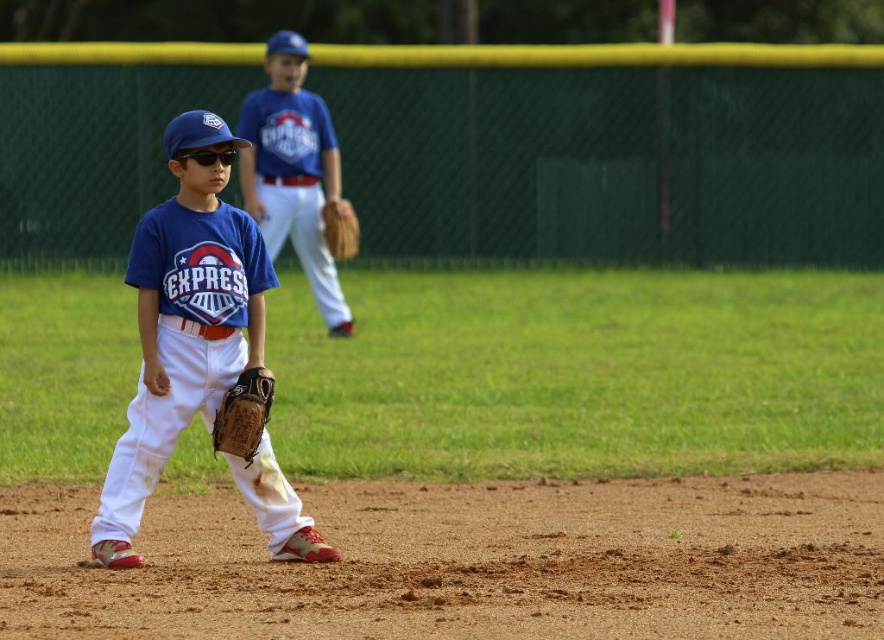
Is point (216, 380) farther from camera compared to point (326, 244)?

No, it is not.

Identify the location of matte blue jersey at center. (200, 352).

This screenshot has width=884, height=640. What do you see at coordinates (200, 352) in the screenshot?
I see `matte blue jersey at center` at bounding box center [200, 352].

This screenshot has height=640, width=884. What are the coordinates of `matte blue jersey at center` in the screenshot? It's located at (200, 352).

Locate an element on the screen. The width and height of the screenshot is (884, 640). matte blue jersey at center is located at coordinates (200, 352).

Does blue jersey at center have a greater height compared to brown leather glove at lower left?

Indeed, blue jersey at center has a greater height compared to brown leather glove at lower left.

Does blue jersey at center have a lesser width compared to brown leather glove at lower left?

Incorrect, blue jersey at center's width is not less than brown leather glove at lower left's.

Find the location of `blue jersey at center`. blue jersey at center is located at coordinates (293, 172).

The image size is (884, 640). What are the coordinates of `blue jersey at center` in the screenshot? It's located at (293, 172).